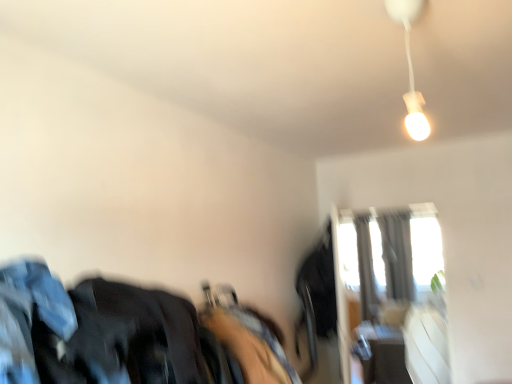
Question: From the image's perspective, relative to white matte lamp at upper right, is transparent glass window at upper right above or below?

Choices:
 (A) above
 (B) below

Answer: (B)

Question: In the image, is transparent glass window at upper right positioned in front of or behind white matte lamp at upper right?

Choices:
 (A) behind
 (B) front

Answer: (A)

Question: Which object is positioned closest to the white matte lamp at upper right?

Choices:
 (A) dark blue fabric at left
 (B) silky gray curtain at upper right
 (C) transparent glass window at upper right

Answer: (A)

Question: Which object is the closest to the dark blue fabric at left?

Choices:
 (A) transparent glass window at upper right
 (B) white matte lamp at upper right
 (C) silky gray curtain at upper right

Answer: (B)